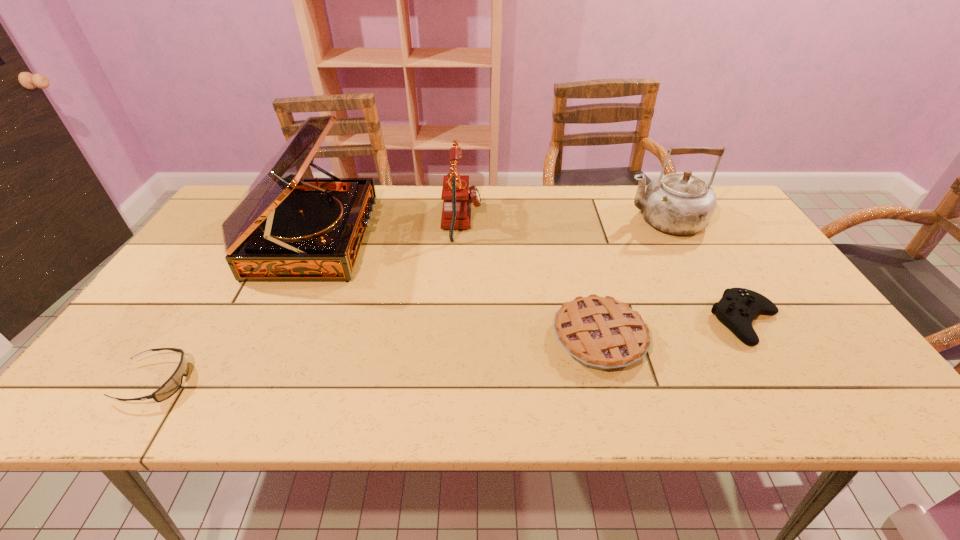
In order to click on record player located in the left edge section of the desktop in this screenshot , I will do `click(284, 228)`.

Identify the location of goggles situated at the left edge. This screenshot has width=960, height=540. (172, 385).

At what (x,y) coordinates should I click in order to perform the action: click on kettle present at the right edge. Please return your answer as a coordinate pair (x, y). Looking at the image, I should click on (679, 203).

Identify the location of control that is at the right edge. This screenshot has height=540, width=960. (738, 307).

This screenshot has width=960, height=540. Identify the location of object at the far left corner. (284, 228).

The width and height of the screenshot is (960, 540). I want to click on object located at the near left corner, so click(x=172, y=385).

Locate an element on the screen. object at the far right corner is located at coordinates (679, 203).

Identify the location of vacant space at the far edge of the desktop. The image size is (960, 540). (599, 211).

The width and height of the screenshot is (960, 540). In order to click on vacant space at the near edge of the desktop in this screenshot , I will do `click(561, 403)`.

The height and width of the screenshot is (540, 960). In order to click on vacant space at the left edge of the desktop in this screenshot , I will do `click(164, 287)`.